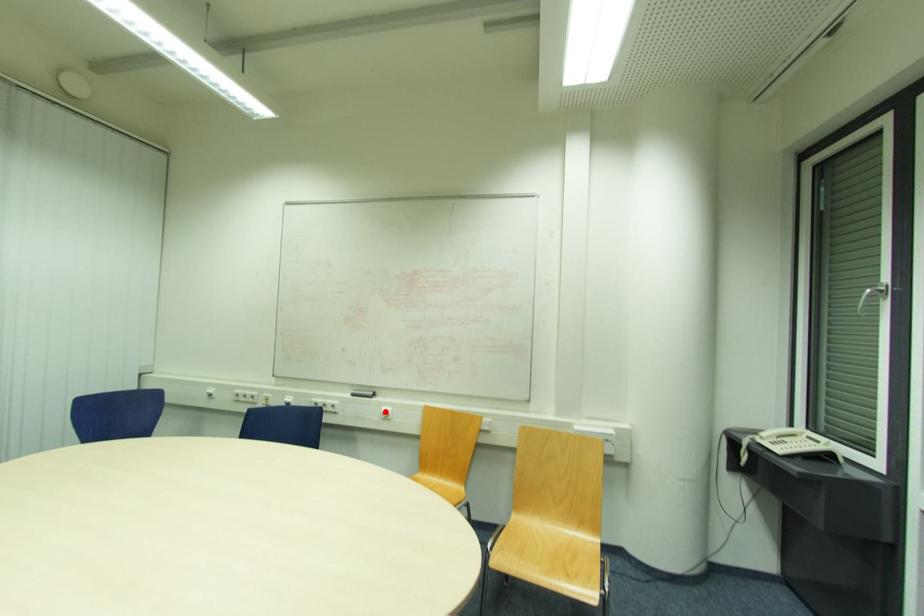
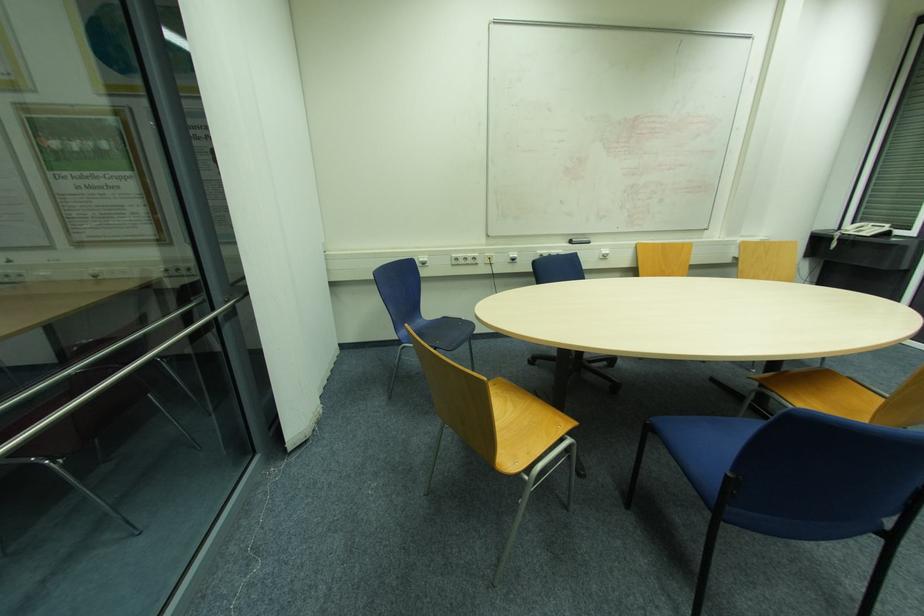
Question: I am providing you with two images of the same scene from different viewpoints. A red point is marked on the first image. Can you still see the location of the red point in image 2?

Choices:
 (A) Yes
 (B) No

Answer: (A)